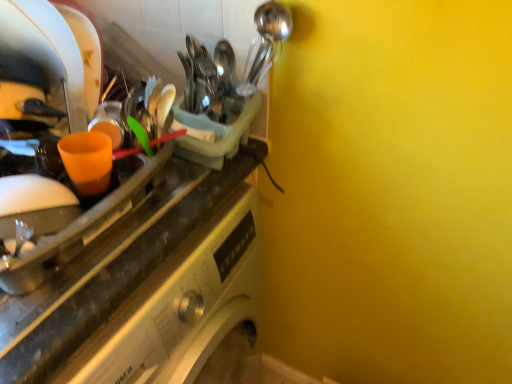
Identify the location of orange plastic cup at left. (146, 288).

Image resolution: width=512 pixels, height=384 pixels. Describe the element at coordinates (146, 288) in the screenshot. I see `orange plastic cup at left` at that location.

At what (x,y) coordinates should I click in order to perform the action: click on orange plastic cup at left. Please return your answer as a coordinate pair (x, y). Looking at the image, I should click on (146, 288).